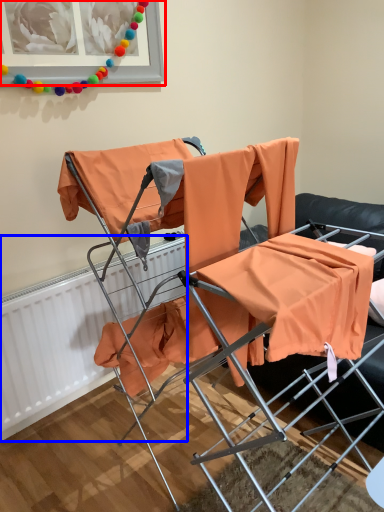
Question: Which point is closer to the camera, picture frame (highlighted by a red box) or radiator (highlighted by a blue box)?

Choices:
 (A) picture frame
 (B) radiator

Answer: (A)